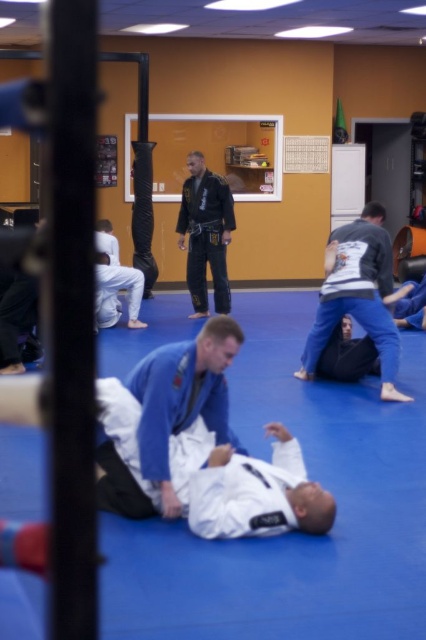
You are standing at the point at point (377, 253) and want to reach the door located at the opposite side of the room. The nearest obstacle is a blue mat covering the floor. Can you walk straight to the door without stepping on the blue mat?

The distance between you and the door is 6.27 meters. Since the blue mat covers the entire floor, walking straight would require stepping on the mat. Therefore, you cannot reach the door without stepping on the blue mat.

You are a new student entering the BJJ gym and see the blue fabric mat at center and the black matte uniform at center. Which object covers more area on the floor?

The blue fabric mat at center is larger in size than the black matte uniform at center, so the blue fabric mat at center covers more area on the floor.

You are a new student entering the BJJ training facility and see the blue fabric mat at center and the black matte uniform at center. Which object is closer to you as you enter the room?

The blue fabric mat at center is closer to you because it is in front of the black matte uniform at center.